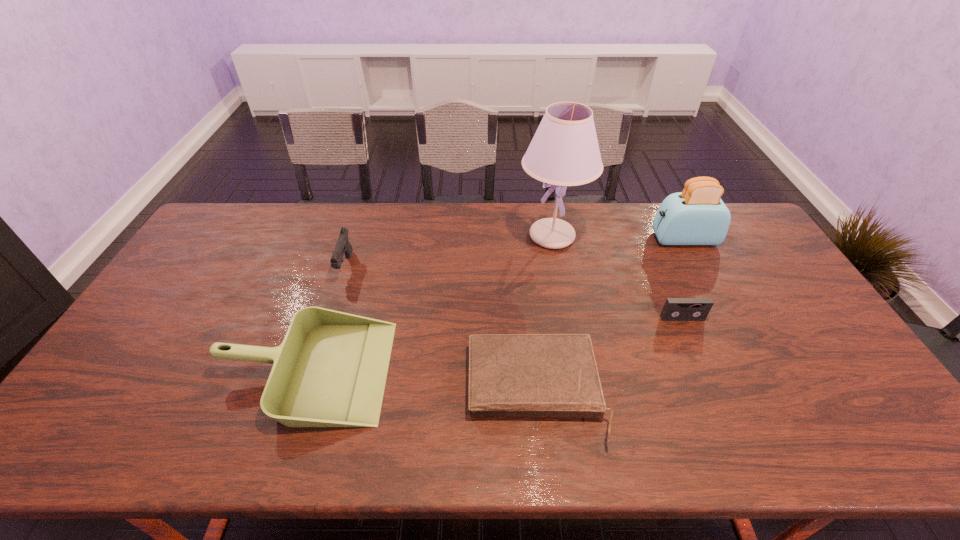
Where is `blank space located 0.170m at the barrel of the pistol`? blank space located 0.170m at the barrel of the pistol is located at coordinates (326, 326).

I want to click on free region located 0.080m on the scoop of the dustpan, so click(419, 370).

You are a GUI agent. You are given a task and a screenshot of the screen. Output one action in this format:
    pyautogui.click(x=<x>, y=<y>)
    Task: Click on the free space located on the front-facing side of the second shortest object
    
    Given the screenshot: What is the action you would take?
    click(x=707, y=374)

This screenshot has height=540, width=960. In order to click on lampshade present at the far edge in this screenshot , I will do `click(564, 151)`.

Locate an element on the screen. toaster at the far edge is located at coordinates (696, 216).

Where is `dustpan that is at the near edge`? The height and width of the screenshot is (540, 960). dustpan that is at the near edge is located at coordinates (330, 371).

This screenshot has height=540, width=960. What are the coordinates of `paperback book at the near edge` in the screenshot? It's located at (539, 375).

In order to click on object located at the right edge in this screenshot , I will do `click(696, 216)`.

What are the coordinates of `object at the far right corner` in the screenshot? It's located at (696, 216).

Locate an element on the screen. free space at the far edge of the desktop is located at coordinates (410, 221).